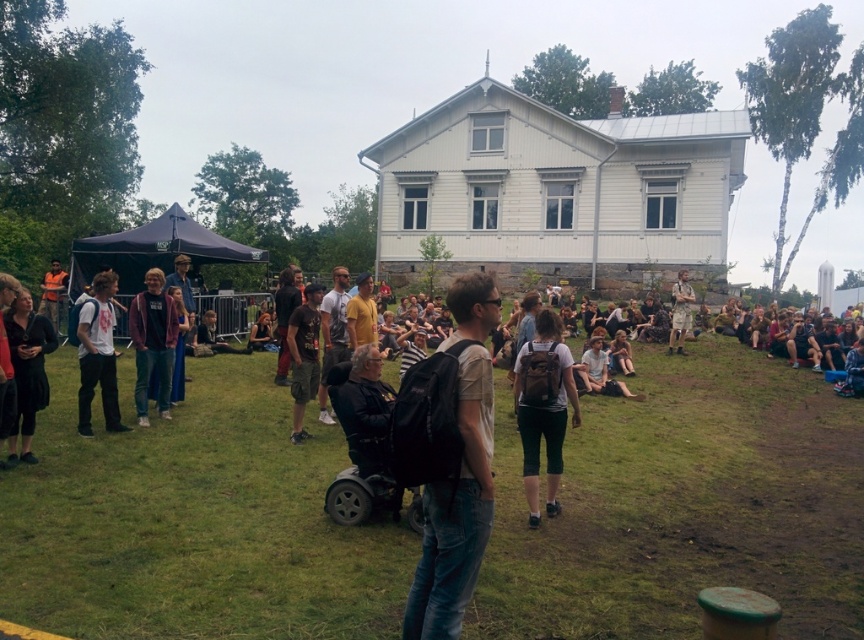
Question: Is matte brown backpack at center to the left of orange reflective vest at left from the viewer's perspective?

Choices:
 (A) yes
 (B) no

Answer: (B)

Question: Does green grass at center have a greater width compared to dark brown fabric pants at center?

Choices:
 (A) yes
 (B) no

Answer: (A)

Question: Which point is farther to the camera?

Choices:
 (A) black matte dress at lower left
 (B) dark brown fabric pants at center

Answer: (B)

Question: Which of the following is the farthest from the observer?

Choices:
 (A) (23, 451)
 (B) (309, 340)
 (C) (684, 317)

Answer: (C)

Question: Which object appears farthest from the camera in this image?

Choices:
 (A) white t-shirt at left
 (B) matte purple jacket at center
 (C) light brown backpack at center

Answer: (B)

Question: Does light brown backpack at center have a smaller size compared to black matte dress at lower left?

Choices:
 (A) no
 (B) yes

Answer: (B)